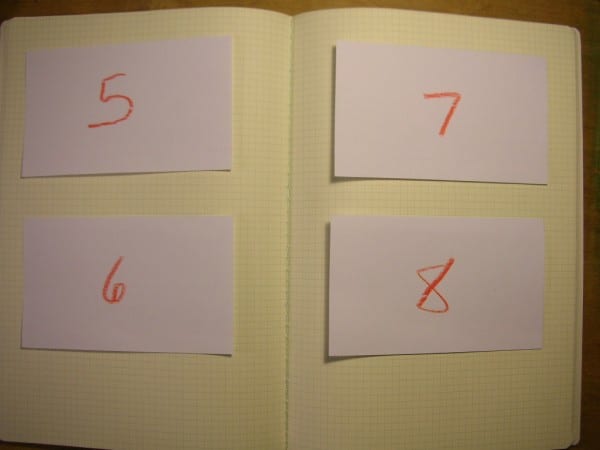
Where is `table`? Image resolution: width=600 pixels, height=450 pixels. table is located at coordinates (550, 11).